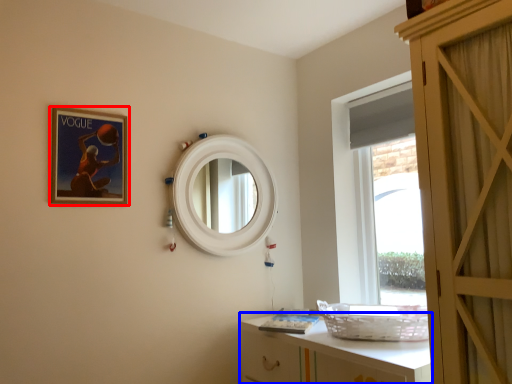
Question: Which point is closer to the camera, picture frame (highlighted by a red box) or cabinetry (highlighted by a blue box)?

Choices:
 (A) picture frame
 (B) cabinetry

Answer: (B)